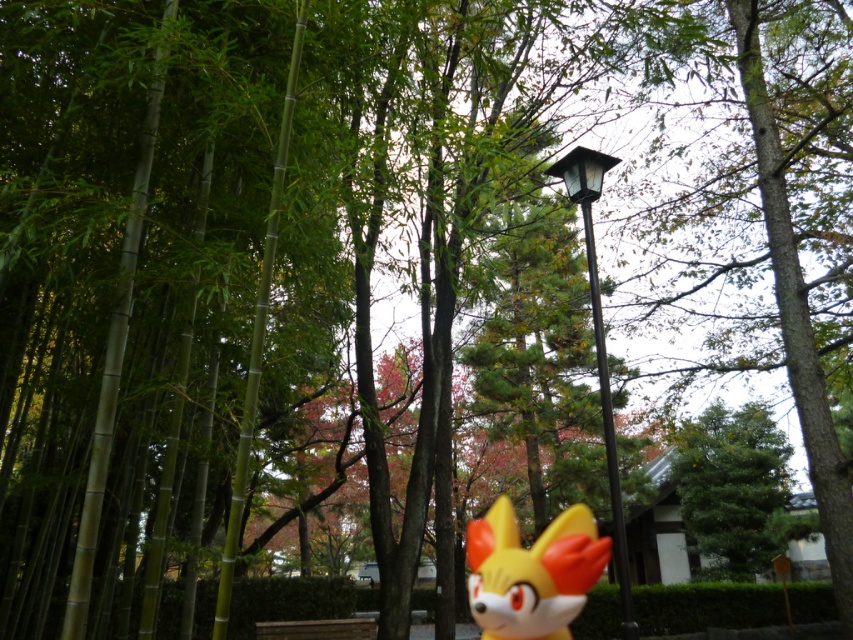
Question: Which point is farther from the camera taking this photo?

Choices:
 (A) (741, 536)
 (B) (590, 276)
 (C) (585, 522)

Answer: (A)

Question: Does green textured tree at center appear under black metal lamp post at center?

Choices:
 (A) yes
 (B) no

Answer: (A)

Question: Can you confirm if green textured tree at center is positioned below yellow matte fox head at center?

Choices:
 (A) no
 (B) yes

Answer: (B)

Question: Can you confirm if green textured tree at center is positioned to the right of black metal lamp post at center?

Choices:
 (A) no
 (B) yes

Answer: (B)

Question: Which object is farther from the camera taking this photo?

Choices:
 (A) black metal lamp post at center
 (B) yellow matte fox head at center
 (C) green textured tree at center

Answer: (C)

Question: Which object appears farthest from the camera in this image?

Choices:
 (A) green textured tree at center
 (B) black metal lamp post at center
 (C) yellow matte fox head at center

Answer: (A)